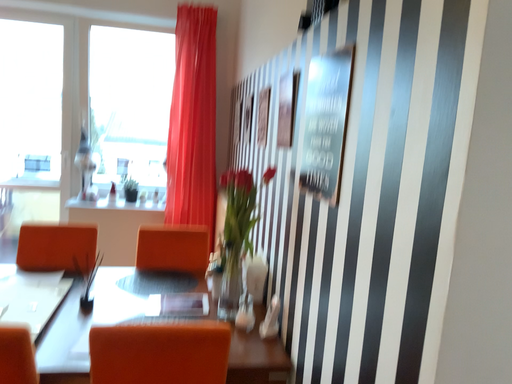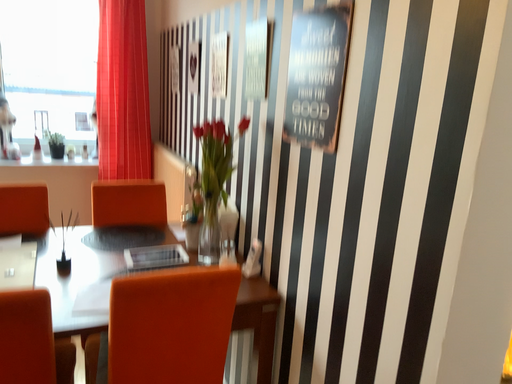
Question: Which way did the camera rotate in the video?

Choices:
 (A) rotated left
 (B) rotated right

Answer: (B)